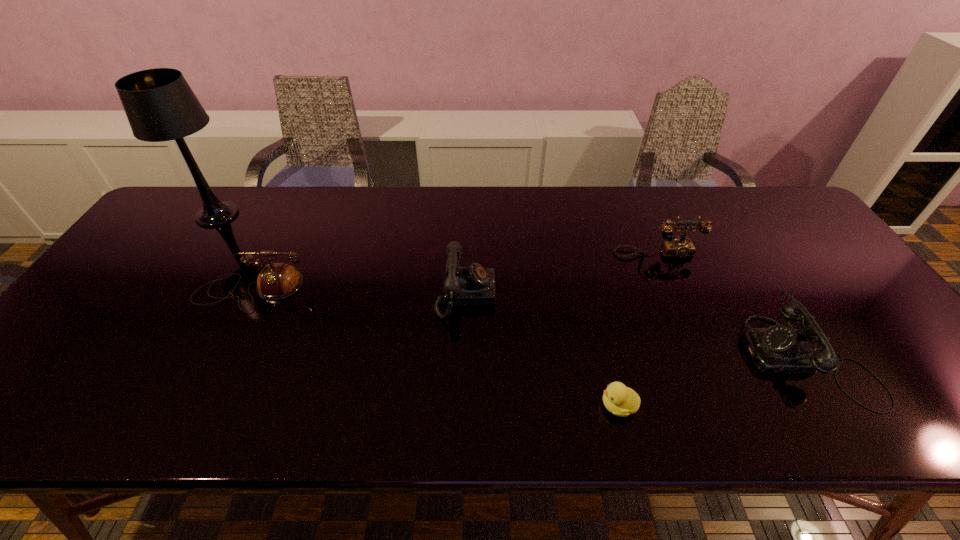
Where is `vacant region located 0.050m on the rotary dial of the leftmost telephone`? vacant region located 0.050m on the rotary dial of the leftmost telephone is located at coordinates (232, 328).

Image resolution: width=960 pixels, height=540 pixels. I want to click on vacant space located at the beak of the shortest object, so click(423, 406).

Find the location of `blank space located 0.110m at the beak of the shortest object`. blank space located 0.110m at the beak of the shortest object is located at coordinates (546, 406).

You are a GUI agent. You are given a task and a screenshot of the screen. Output one action in this format:
    pyautogui.click(x=<x>, y=<y>)
    Task: Click on the vacant region located at the beak of the shortest object
    This screenshot has height=540, width=960.
    Given the screenshot: What is the action you would take?
    pyautogui.click(x=409, y=406)

You are a GUI agent. You are given a task and a screenshot of the screen. Output one action in this format:
    pyautogui.click(x=<x>, y=<y>)
    Task: Click on the object situated at the far edge
    The width and height of the screenshot is (960, 540).
    Given the screenshot: What is the action you would take?
    pyautogui.click(x=160, y=106)

This screenshot has height=540, width=960. Find the location of `telephone at the near edge`. telephone at the near edge is located at coordinates (780, 349).

Identify the location of duckling that is positioned at the near edge. (618, 399).

Image resolution: width=960 pixels, height=540 pixels. I want to click on object that is at the left edge, so tap(160, 106).

Locate an element on the screen. This screenshot has width=960, height=540. object at the right edge is located at coordinates (780, 349).

Locate an element on the screen. The width and height of the screenshot is (960, 540). object present at the far left corner is located at coordinates (160, 106).